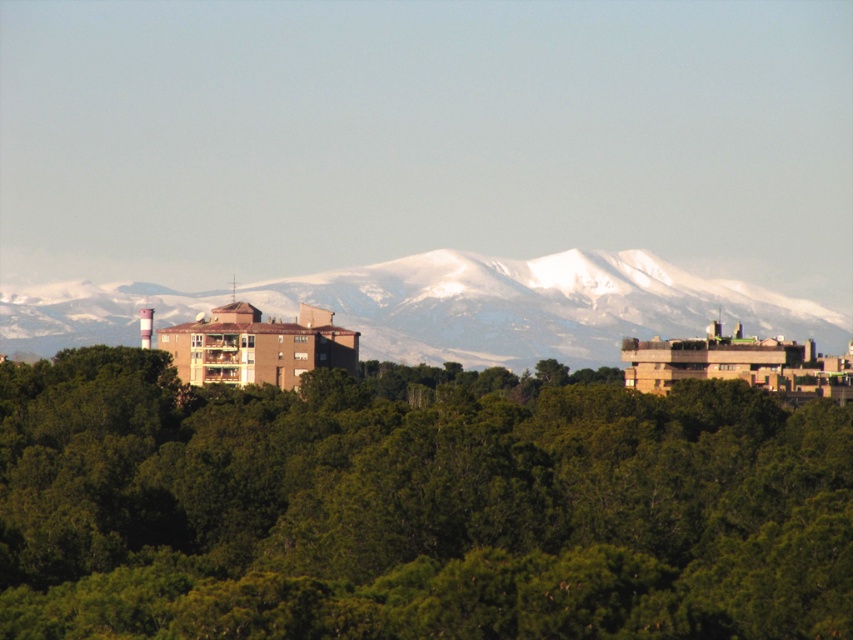
You are standing at the point marked by the coordinates point [413,509] in the image. Looking towards the mountains, which direction should you face to see the green leafy trees at center?

The point [413,509] marks the green leafy trees at center, so you are already facing the direction of the green leafy trees at center. To see them, you should look straight ahead.

You are standing in the scenic landscape and want to take a photo of both the green leafy trees at center and the snowy white mountain range at upper center. Which object will appear closer to the camera in the photo?

The green leafy trees at center will appear closer to the camera because they are taller than the snowy white mountain range at upper center.